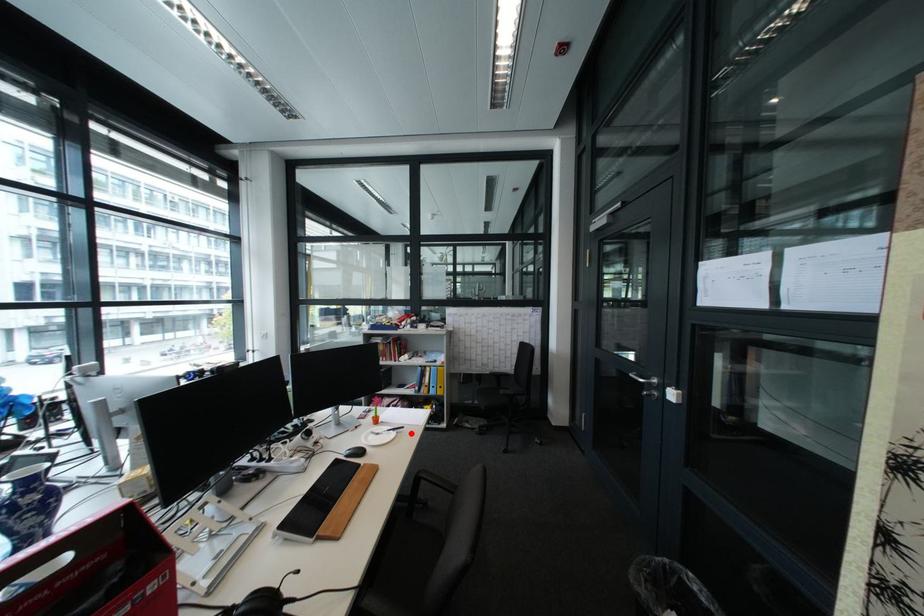
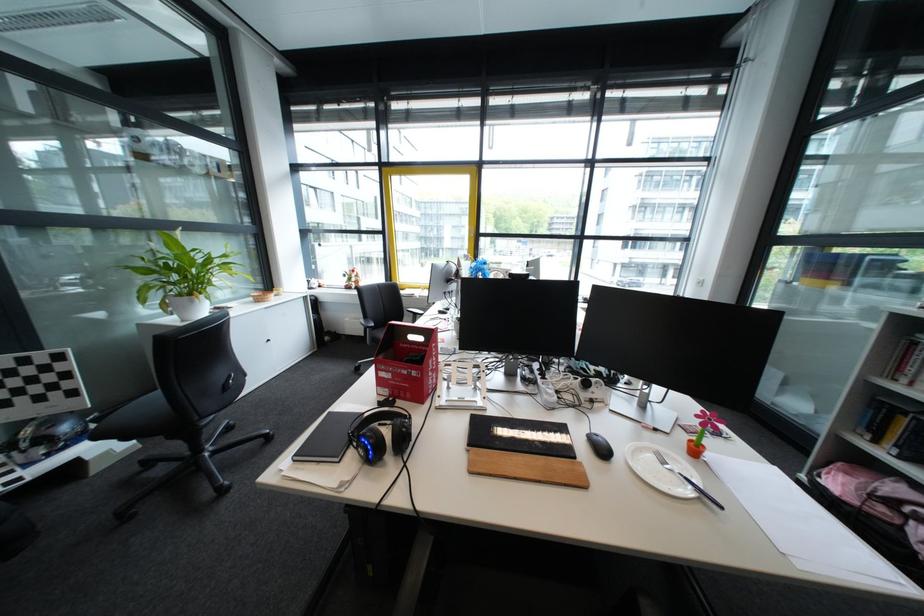
Question: I am providing you with two images of the same scene from different viewpoints. In image1, a red point is highlighted. Considering the same 3D point in image2, which of the following is correct?

Choices:
 (A) It is closer
 (B) It is farther

Answer: (B)